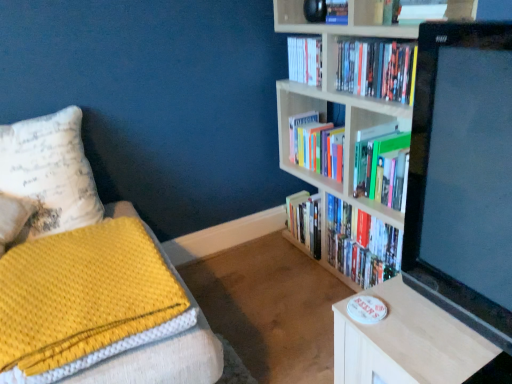
Describe the element at coordinates (338, 103) in the screenshot. The height and width of the screenshot is (384, 512). I see `white matte bookcase at upper right` at that location.

What are the coordinates of `yellow textured blanket at lower left` in the screenshot? It's located at (84, 301).

The image size is (512, 384). What do you see at coordinates (316, 145) in the screenshot? I see `hardcover books at center, the first book in the back-to-front sequence` at bounding box center [316, 145].

Identify the location of black glossy monitor at upper right. This screenshot has height=384, width=512. (462, 176).

You are a GUI agent. You are given a task and a screenshot of the screen. Output one action in this format:
    pyautogui.click(x=<x>, y=<y>)
    Task: Click on the hardcover books at upper right, which is the 3th book from back to front
    This screenshot has width=512, height=384.
    Given the screenshot: What is the action you would take?
    pyautogui.click(x=377, y=69)

Is black glossy monitor at upper right in front of light wood table at lower right?

Yes, the depth of black glossy monitor at upper right is less than that of light wood table at lower right.

Looking at this image, who is taller, black glossy monitor at upper right or light wood table at lower right?

black glossy monitor at upper right is taller.

From the image's perspective, is black glossy monitor at upper right over light wood table at lower right?

Indeed, from the image's perspective, black glossy monitor at upper right is shown above light wood table at lower right.

Does black glossy monitor at upper right have a lesser width compared to light wood table at lower right?

Yes, black glossy monitor at upper right is thinner than light wood table at lower right.

What's the angular difference between white paperback book at upper center, the 3th book from the front, and black glossy monitor at upper right's facing directions?

The angular difference between white paperback book at upper center, the 3th book from the front, and black glossy monitor at upper right is 1.66 degrees.

Find the location of a particular element. computer monitor in front of the white paperback book at upper center, the 2th book in the back-to-front sequence is located at coordinates (462, 176).

Measure the distance between white paperback book at upper center, the 3th book from the front, and black glossy monitor at upper right.

white paperback book at upper center, the 3th book from the front, is 3.43 feet away from black glossy monitor at upper right.

Considering the sizes of white paperback book at upper center, the 2th book in the back-to-front sequence, and black glossy monitor at upper right in the image, is white paperback book at upper center, the 2th book in the back-to-front sequence, taller or shorter than black glossy monitor at upper right?

In the image, white paperback book at upper center, the 2th book in the back-to-front sequence, appears to be shorter than black glossy monitor at upper right.

Could you tell me if light wood table at lower right is facing white paper at upper center, the 1th book in the front-to-back sequence?

No, light wood table at lower right does not turn towards white paper at upper center, the 1th book in the front-to-back sequence.

Is light wood table at lower right positioned far away from white paper at upper center, the 1th book in the front-to-back sequence?

No.

The image size is (512, 384). What are the coordinates of `the 4th book above the light wood table at lower right (from the image's perspective)` in the screenshot? It's located at (424, 11).

Is light wood table at lower right closer to camera compared to white paper at upper center, which appears as the 4th book when viewed from the back?

That is True.

Is light wood table at lower right positioned beyond the bounds of yellow textured blanket at lower left?

Yes, light wood table at lower right is not within yellow textured blanket at lower left.

Is light wood table at lower right thinner than yellow textured blanket at lower left?

Indeed, light wood table at lower right has a lesser width compared to yellow textured blanket at lower left.

Does light wood table at lower right come in front of yellow textured blanket at lower left?

Yes, light wood table at lower right is closer to the viewer.

How many degrees apart are the facing directions of light wood table at lower right and yellow textured blanket at lower left?

The angle between the facing direction of light wood table at lower right and the facing direction of yellow textured blanket at lower left is 89.8 degrees.

Measure the distance between hardcover books at center, the first book in the back-to-front sequence, and white matte bookcase at upper right.

A distance of 6.05 inches exists between hardcover books at center, the first book in the back-to-front sequence, and white matte bookcase at upper right.

From a real-world perspective, which object stands above the other?

white matte bookcase at upper right, from a real-world perspective.

From the image's perspective, which one is positioned higher, hardcover books at center, which ranks as the fourth book in front-to-back order, or white matte bookcase at upper right?

hardcover books at center, which ranks as the fourth book in front-to-back order, from the image's perspective.

Is the surface of hardcover books at center, which ranks as the fourth book in front-to-back order, in direct contact with white matte bookcase at upper right?

A: No, hardcover books at center, which ranks as the fourth book in front-to-back order, is not in contact with white matte bookcase at upper right.

Does hardcover books at upper right, the 2th book positioned from the front, appear on the right side of white paperback book at upper center, the 2th book in the back-to-front sequence?

Correct, you'll find hardcover books at upper right, the 2th book positioned from the front, to the right of white paperback book at upper center, the 2th book in the back-to-front sequence.

Can you tell me how much hardcover books at upper right, which is the 3th book from back to front, and white paperback book at upper center, the 3th book from the front, differ in facing direction?

The facing directions of hardcover books at upper right, which is the 3th book from back to front, and white paperback book at upper center, the 3th book from the front, are 0.682 degrees apart.

Is point (393, 100) positioned in front of point (303, 45)?

Yes, it is in front of point (303, 45).

Relative to hardcover books at upper right, which is the 3th book from back to front, is black glossy monitor at upper right in front or behind?

black glossy monitor at upper right is in front of hardcover books at upper right, which is the 3th book from back to front.

Considering the sizes of objects black glossy monitor at upper right and hardcover books at upper right, which is the 3th book from back to front, in the image provided, who is bigger, black glossy monitor at upper right or hardcover books at upper right, which is the 3th book from back to front,?

With larger size is black glossy monitor at upper right.

Which is closer, (478, 238) or (348, 90)?

The point (478, 238) is in front.

Is black glossy monitor at upper right taller or shorter than hardcover books at upper right, which is the 3th book from back to front?

In the image, black glossy monitor at upper right appears to be taller than hardcover books at upper right, which is the 3th book from back to front.

The image size is (512, 384). I want to click on computer monitor on the left of the light wood table at lower right, so click(x=462, y=176).

Identify the location of book that is the 3rd one when counting backward from the black glossy monitor at upper right. The image size is (512, 384). (305, 60).

Which object lies nearer to the anchor point white paperback book at upper center, the 3th book from the front, white paper at upper center, the 1th book in the front-to-back sequence, or hardcover books at center, the first book in the back-to-front sequence?

Based on the image, hardcover books at center, the first book in the back-to-front sequence, appears to be nearer to white paperback book at upper center, the 3th book from the front.

When comparing their distances from light wood table at lower right, does white paperback book at upper center, the 3th book from the front, or black glossy monitor at upper right seem further?

white paperback book at upper center, the 3th book from the front, is positioned further to the anchor light wood table at lower right.

Based on their spatial positions, is yellow textured blanket at lower left or hardcover books at upper right, the 2th book positioned from the front, further from black glossy monitor at upper right?

yellow textured blanket at lower left.

Looking at the image, which one is located further to white matte bookcase at upper right, hardcover books at upper right, which is the 3th book from back to front, or white paperback book at upper center, the 3th book from the front?

Based on the image, white paperback book at upper center, the 3th book from the front, appears to be further to white matte bookcase at upper right.

Estimate the real-world distances between objects in this image. Which object is closer to light wood table at lower right, black glossy monitor at upper right or hardcover books at upper right, the 2th book positioned from the front?

Among the two, black glossy monitor at upper right is located nearer to light wood table at lower right.

From the image, which object appears to be nearer to white paper at upper center, the 1th book in the front-to-back sequence, yellow textured blanket at lower left or white matte bookcase at upper right?

Based on the image, white matte bookcase at upper right appears to be nearer to white paper at upper center, the 1th book in the front-to-back sequence.

Considering their positions, is hardcover books at upper right, which is the 3th book from back to front, positioned closer to white paper at upper center, the 1th book in the front-to-back sequence, than black glossy monitor at upper right?

Among the two, hardcover books at upper right, which is the 3th book from back to front, is located nearer to white paper at upper center, the 1th book in the front-to-back sequence.

From the image, which object appears to be nearer to hardcover books at upper right, which is the 3th book from back to front, white paperback book at upper center, the 3th book from the front, or yellow textured blanket at lower left?

white paperback book at upper center, the 3th book from the front.

The image size is (512, 384). Find the location of `bookcase located between black glossy monitor at upper right and hardcover books at center, the first book in the back-to-front sequence, in the depth direction`. bookcase located between black glossy monitor at upper right and hardcover books at center, the first book in the back-to-front sequence, in the depth direction is located at coordinates (338, 103).

Where is `bookcase located between light wood table at lower right and hardcover books at center, the first book in the back-to-front sequence, in the depth direction`? The image size is (512, 384). bookcase located between light wood table at lower right and hardcover books at center, the first book in the back-to-front sequence, in the depth direction is located at coordinates (338, 103).

Find the location of `book between white paper at upper center, which appears as the 4th book when viewed from the back, and white paperback book at upper center, the 2th book in the back-to-front sequence, in the front-back direction`. book between white paper at upper center, which appears as the 4th book when viewed from the back, and white paperback book at upper center, the 2th book in the back-to-front sequence, in the front-back direction is located at coordinates (377, 69).

Locate an element on the screen. computer monitor between yellow textured blanket at lower left and white paper at upper center, the 1th book in the front-to-back sequence, in the horizontal direction is located at coordinates coord(462,176).